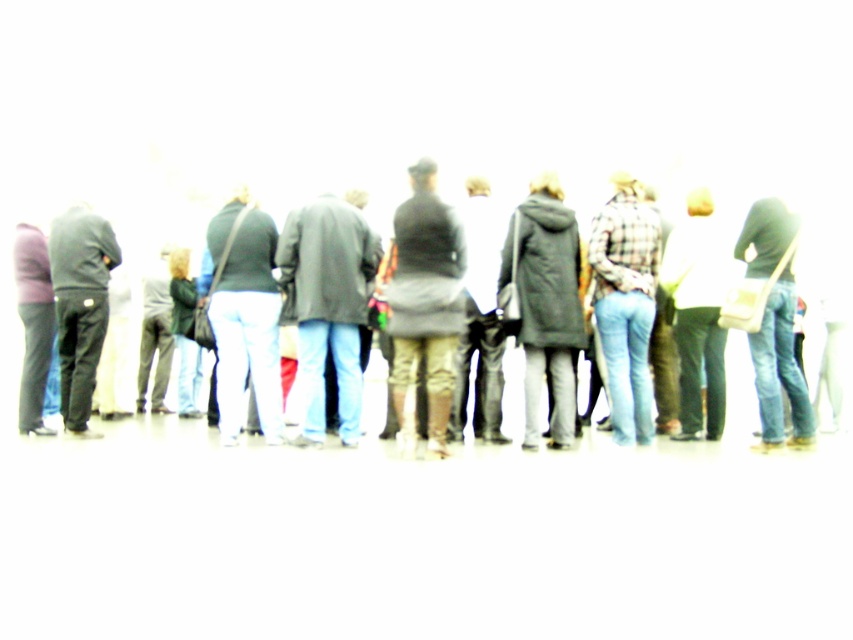
Is point (636, 244) positioned in front of point (61, 291)?

Yes, point (636, 244) is closer to viewer.

Does plaid fabric shirt at center lie behind dark gray pants at left?

No, plaid fabric shirt at center is in front of dark gray pants at left.

This screenshot has height=640, width=853. Find the location of `plaid fabric shirt at center`. plaid fabric shirt at center is located at coordinates (625, 304).

Can you confirm if matte black coat at center is positioned below dark gray coat at center?

Incorrect, matte black coat at center is not positioned below dark gray coat at center.

Does point (741, 348) come farther from viewer compared to point (334, 285)?

Yes, point (741, 348) is behind point (334, 285).

Locate an element on the screen. The width and height of the screenshot is (853, 640). matte black coat at center is located at coordinates (824, 291).

Between dark gray coat at center and dark gray pants at left, which one is positioned lower?

dark gray pants at left is below.

Is dark gray coat at center bigger than dark gray pants at left?

Yes.

The image size is (853, 640). I want to click on dark gray coat at center, so click(x=328, y=307).